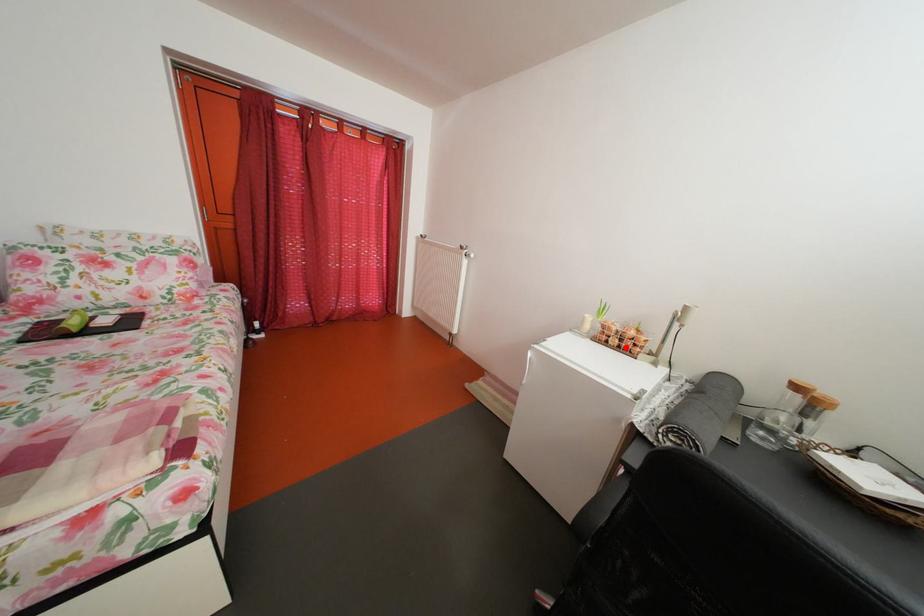
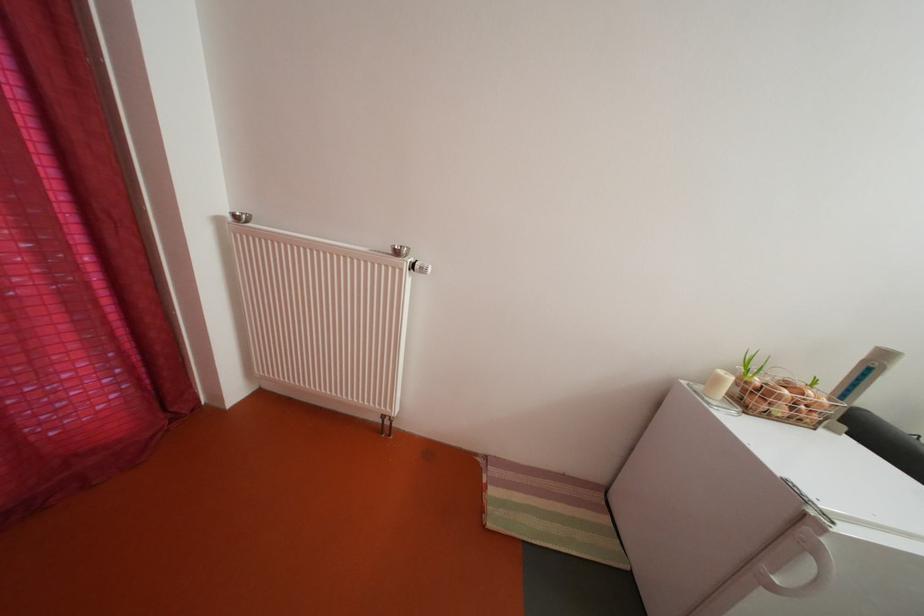
Question: I am providing you with two images of the same scene from different viewpoints. A red point is marked on the first image. At the location where the point appears in image 1, is it still visible in image 2?

Choices:
 (A) Yes
 (B) No

Answer: (A)